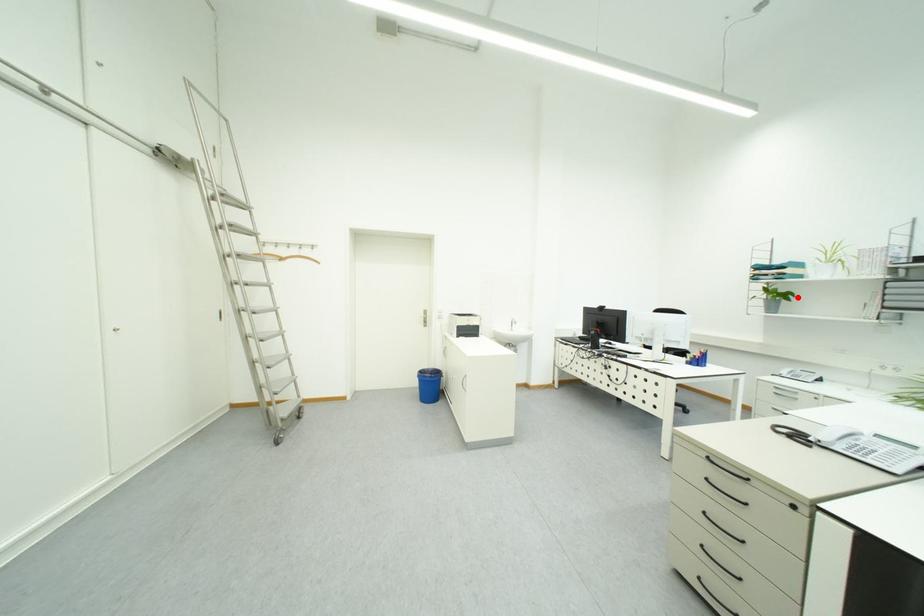
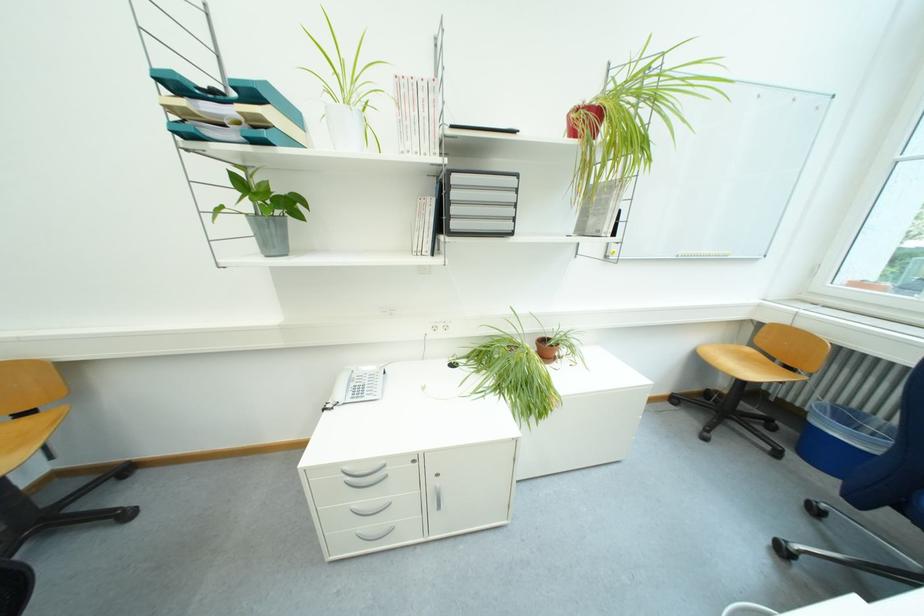
Locate, in the second image, the point that corresponds to the highlighted location in the first image.

(302, 206)